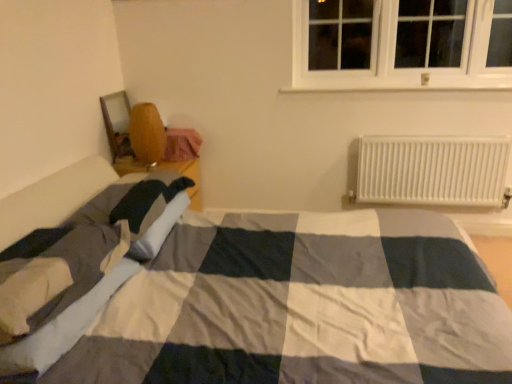
Question: Is wooden chair at left inside white cotton blanket at lower left?

Choices:
 (A) no
 (B) yes

Answer: (A)

Question: From the image's perspective, would you say white cotton blanket at lower left is shown under wooden chair at left?

Choices:
 (A) no
 (B) yes

Answer: (B)

Question: Is white cotton blanket at lower left thinner than wooden chair at left?

Choices:
 (A) yes
 (B) no

Answer: (A)

Question: Can you confirm if white cotton blanket at lower left is positioned to the left of wooden chair at left?

Choices:
 (A) no
 (B) yes

Answer: (B)

Question: Does white cotton blanket at lower left appear on the right side of wooden chair at left?

Choices:
 (A) no
 (B) yes

Answer: (A)

Question: In terms of size, does white plastic radiator at right appear bigger or smaller than wooden chair at left?

Choices:
 (A) big
 (B) small

Answer: (A)

Question: Considering the positions of point (428, 193) and point (170, 135), is point (428, 193) closer or farther from the camera than point (170, 135)?

Choices:
 (A) farther
 (B) closer

Answer: (B)

Question: Which is correct: white plastic radiator at right is inside wooden chair at left, or outside of it?

Choices:
 (A) outside
 (B) inside

Answer: (A)

Question: Is white plastic radiator at right in front of or behind wooden chair at left in the image?

Choices:
 (A) front
 (B) behind

Answer: (A)

Question: Choose the correct answer: Is white cotton blanket at lower left inside wooden chair at left or outside it?

Choices:
 (A) inside
 (B) outside

Answer: (B)

Question: Is white cotton blanket at lower left bigger or smaller than wooden chair at left?

Choices:
 (A) small
 (B) big

Answer: (B)

Question: From a real-world perspective, is white cotton blanket at lower left positioned above or below wooden chair at left?

Choices:
 (A) below
 (B) above

Answer: (A)

Question: Is white cotton blanket at lower left taller or shorter than wooden chair at left?

Choices:
 (A) short
 (B) tall

Answer: (A)

Question: Based on their sizes in the image, would you say wooden chair at left is bigger or smaller than white plastic radiator at right?

Choices:
 (A) small
 (B) big

Answer: (A)

Question: In terms of width, does wooden chair at left look wider or thinner when compared to white plastic radiator at right?

Choices:
 (A) wide
 (B) thin

Answer: (A)